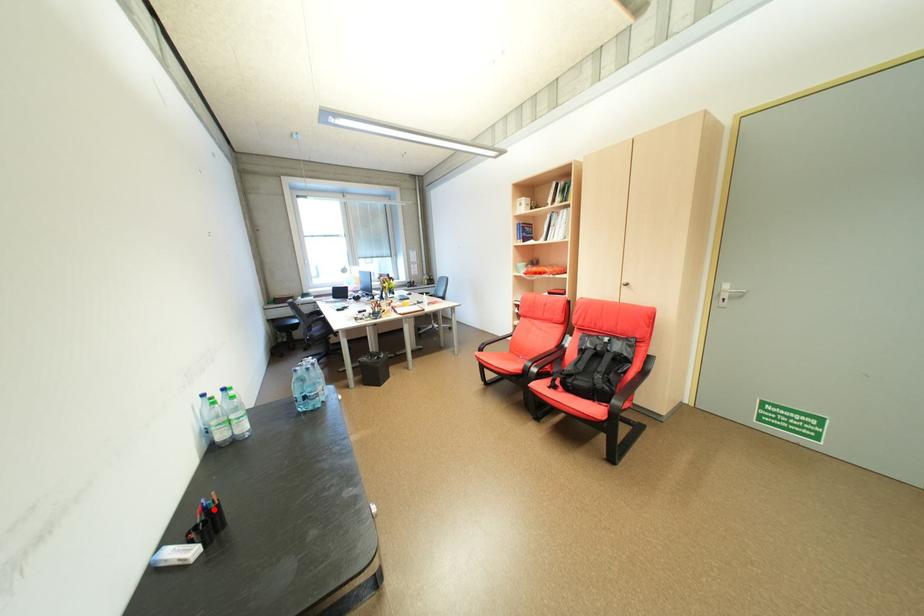
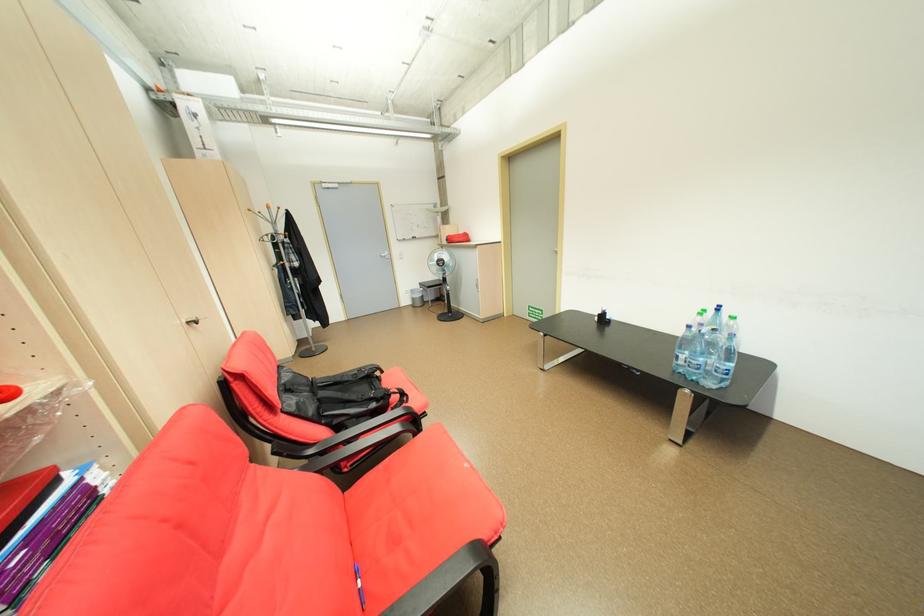
Find the pixel in the second image that matches the highlighted location in the first image.

(613, 313)